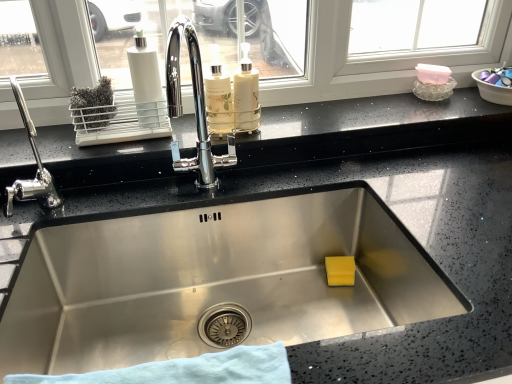
Question: Is blue cloth at bottom next to chrome metallic faucet at left and touching it?

Choices:
 (A) no
 (B) yes

Answer: (A)

Question: Is blue cloth at bottom shorter than chrome metallic faucet at left?

Choices:
 (A) no
 (B) yes

Answer: (B)

Question: From the image's perspective, would you say blue cloth at bottom is shown under chrome metallic faucet at left?

Choices:
 (A) yes
 (B) no

Answer: (A)

Question: Is blue cloth at bottom at the left side of chrome metallic faucet at left?

Choices:
 (A) no
 (B) yes

Answer: (A)

Question: From a real-world perspective, is blue cloth at bottom positioned over chrome metallic faucet at left based on gravity?

Choices:
 (A) no
 (B) yes

Answer: (A)

Question: Considering their positions, is chrome metallic faucet at left located in front of or behind white matte bottle at center, which is the 1th bottle from right to left?

Choices:
 (A) behind
 (B) front

Answer: (B)

Question: Is chrome metallic faucet at left bigger or smaller than white matte bottle at center, positioned as the second bottle in left-to-right order?

Choices:
 (A) big
 (B) small

Answer: (A)

Question: Does point (35, 195) appear closer or farther from the camera than point (233, 87)?

Choices:
 (A) farther
 (B) closer

Answer: (B)

Question: Looking at their shapes, would you say chrome metallic faucet at left is wider or thinner than white matte bottle at center, which is the 1th bottle from right to left?

Choices:
 (A) wide
 (B) thin

Answer: (A)

Question: Considering the positions of white matte bottle at center, which is the 1th bottle from right to left, and translucent glass bottle at center, arranged as the 1th bottle when viewed from the left, in the image, is white matte bottle at center, which is the 1th bottle from right to left, bigger or smaller than translucent glass bottle at center, arranged as the 1th bottle when viewed from the left,?

Choices:
 (A) big
 (B) small

Answer: (A)

Question: Looking at their shapes, would you say white matte bottle at center, positioned as the second bottle in left-to-right order, is wider or thinner than translucent glass bottle at center, arranged as the 1th bottle when viewed from the left?

Choices:
 (A) thin
 (B) wide

Answer: (B)

Question: In the image, is white matte bottle at center, which is the 1th bottle from right to left, on the left side or the right side of translucent glass bottle at center, positioned as the second bottle in right-to-left order?

Choices:
 (A) right
 (B) left

Answer: (A)

Question: From a real-world perspective, relative to translucent glass bottle at center, positioned as the second bottle in right-to-left order, is white matte bottle at center, which is the 1th bottle from right to left, vertically above or below?

Choices:
 (A) above
 (B) below

Answer: (A)

Question: Considering the positions of chrome metallic faucet at left and translucent glass bottle at center, positioned as the second bottle in right-to-left order, in the image, is chrome metallic faucet at left wider or thinner than translucent glass bottle at center, positioned as the second bottle in right-to-left order,?

Choices:
 (A) wide
 (B) thin

Answer: (A)

Question: Considering the positions of chrome metallic faucet at left and translucent glass bottle at center, positioned as the second bottle in right-to-left order, in the image, is chrome metallic faucet at left bigger or smaller than translucent glass bottle at center, positioned as the second bottle in right-to-left order,?

Choices:
 (A) big
 (B) small

Answer: (A)